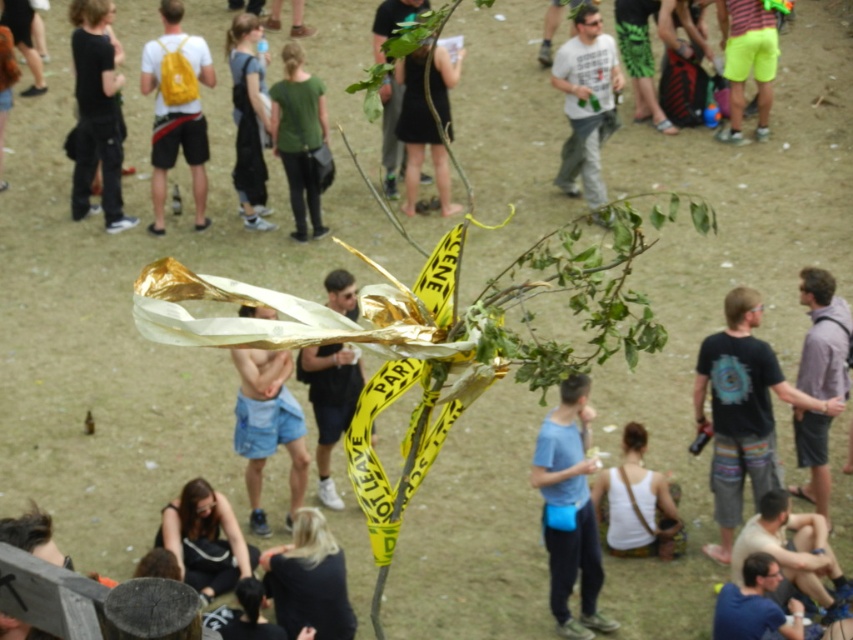
Question: Which object is positioned farthest from the yellow matte backpack at upper left?

Choices:
 (A) blue fabric shirt at lower right
 (B) neon yellow shorts at right

Answer: (A)

Question: Can you confirm if white cotton t-shirt at center is bigger than white fabric bag at lower center?

Choices:
 (A) no
 (B) yes

Answer: (B)

Question: Which of the following is the farthest from the observer?

Choices:
 (A) tap(294, 192)
 (B) tap(793, 604)
 (C) tap(793, 536)

Answer: (A)

Question: Can you confirm if dark gray overalls at center is thinner than neon yellow shorts at right?

Choices:
 (A) no
 (B) yes

Answer: (B)

Question: Does dark brown hair at lower center appear on the right side of dark gray overalls at center?

Choices:
 (A) no
 (B) yes

Answer: (B)

Question: Which object is the closest to the dark gray overalls at center?

Choices:
 (A) white cotton t-shirt at center
 (B) yellow matte backpack at upper left

Answer: (B)